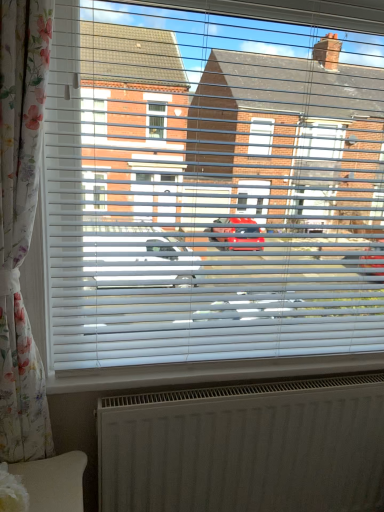
Question: From the image's perspective, is white textured radiator at lower center positioned above or below floral fabric curtain at left?

Choices:
 (A) below
 (B) above

Answer: (A)

Question: Considering the positions of point (263, 411) and point (6, 217), is point (263, 411) closer or farther from the camera than point (6, 217)?

Choices:
 (A) farther
 (B) closer

Answer: (A)

Question: Which object is the farthest from the floral fabric curtain at left?

Choices:
 (A) white plastic blinds at center
 (B) white textured radiator at lower center

Answer: (B)

Question: Based on their relative distances, which object is nearer to the white textured radiator at lower center?

Choices:
 (A) floral fabric curtain at left
 (B) white plastic blinds at center

Answer: (B)